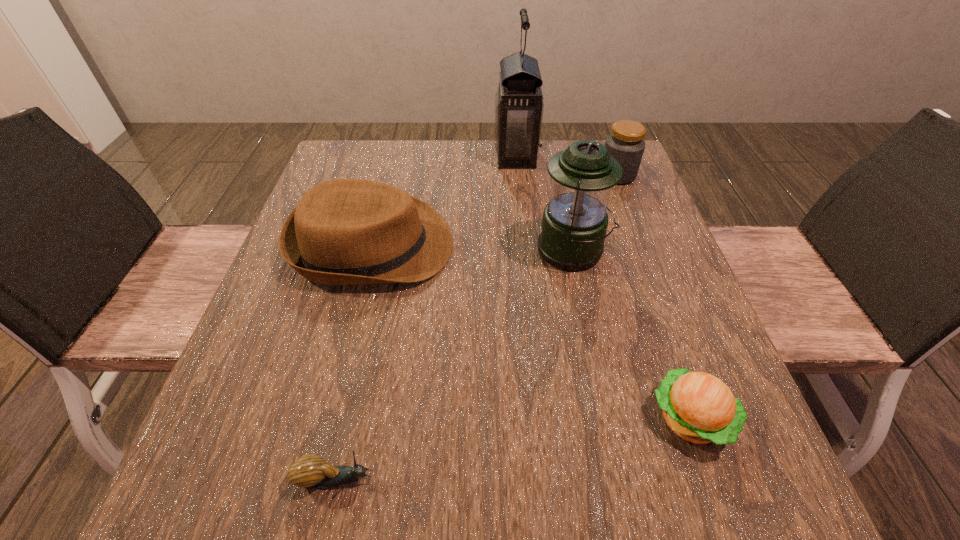
Find the location of a particular element. The image size is (960, 540). lantern situated at the far edge is located at coordinates (519, 105).

This screenshot has width=960, height=540. I want to click on jar that is at the far edge, so click(625, 144).

Locate an element on the screen. Image resolution: width=960 pixels, height=540 pixels. hamburger that is at the near edge is located at coordinates (700, 408).

Locate an element on the screen. Image resolution: width=960 pixels, height=540 pixels. escargot present at the near edge is located at coordinates (311, 471).

You are a GUI agent. You are given a task and a screenshot of the screen. Output one action in this format:
    pyautogui.click(x=<x>, y=<y>)
    Task: Click on the fedora at the left edge
    The image size is (960, 540).
    Given the screenshot: What is the action you would take?
    pyautogui.click(x=346, y=231)

At what (x,y) coordinates should I click in order to perform the action: click on escargot present at the left edge. Please return your answer as a coordinate pair (x, y). Image resolution: width=960 pixels, height=540 pixels. Looking at the image, I should click on (311, 471).

This screenshot has height=540, width=960. Identify the location of lantern present at the right edge. (574, 223).

Where is `jar located in the right edge section of the desktop`? The width and height of the screenshot is (960, 540). jar located in the right edge section of the desktop is located at coordinates (625, 144).

Locate an element on the screen. This screenshot has height=540, width=960. hamburger that is at the right edge is located at coordinates (700, 408).

The width and height of the screenshot is (960, 540). What are the coordinates of `object at the near left corner` in the screenshot? It's located at (311, 471).